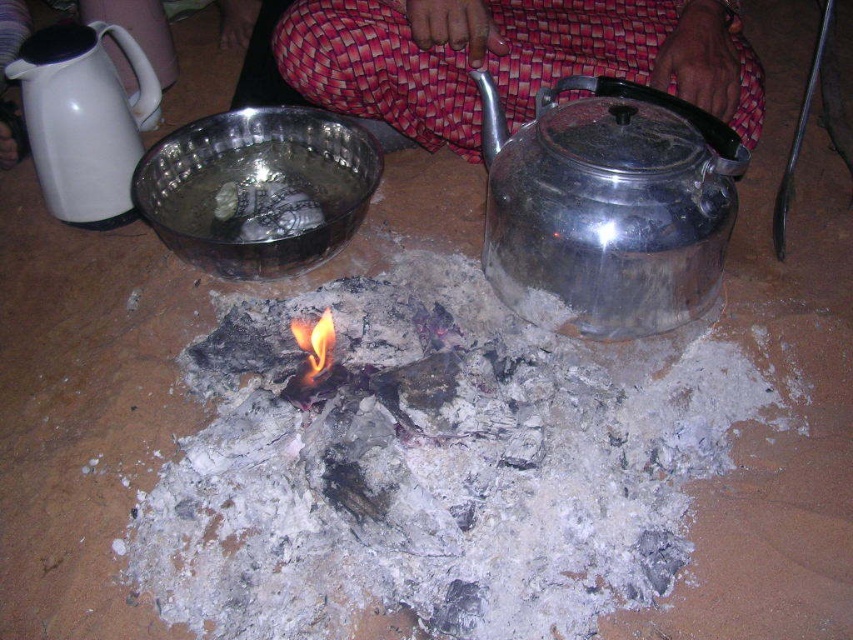
Which is below, red woven pants at center or flametransparentfire at center?

Positioned lower is flametransparentfire at center.

Does point (734, 116) come closer to viewer compared to point (314, 346)?

No, (734, 116) is behind (314, 346).

Locate an element on the screen. red woven pants at center is located at coordinates (509, 58).

Does charcoal ash at center have a lesser width compared to shiny metallic teapot at right?

In fact, charcoal ash at center might be wider than shiny metallic teapot at right.

Which is in front, point (291, 524) or point (519, 147)?

Point (291, 524)

Is point (697, 419) farther from camera compared to point (631, 316)?

No.

Identify the location of charcoal ash at center. point(433,467).

Between point (589, 84) and point (323, 348), which one is positioned behind?

The point (589, 84) is more distant.

Does shiny metallic teapot at right have a greater width compared to flametransparentfire at center?

Yes.

Identify the location of shiny metallic teapot at right. The image size is (853, 640). (608, 205).